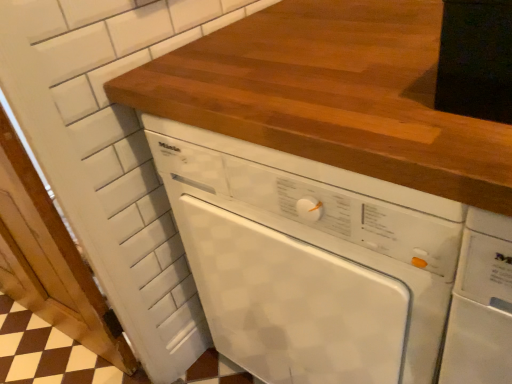
Where is `empty space that is ontop of wooden countertop at center`? The width and height of the screenshot is (512, 384). empty space that is ontop of wooden countertop at center is located at coordinates (334, 43).